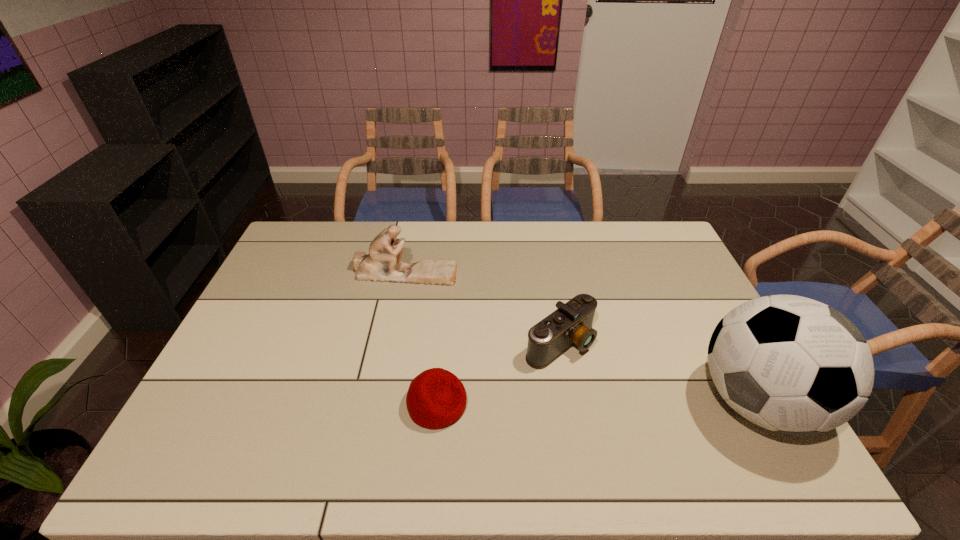
Where is `beanbag`? The height and width of the screenshot is (540, 960). beanbag is located at coordinates (436, 398).

Where is `soccer ball`? Image resolution: width=960 pixels, height=540 pixels. soccer ball is located at coordinates (790, 364).

Image resolution: width=960 pixels, height=540 pixels. What are the coordinates of `the rightmost object` in the screenshot? It's located at (790, 364).

Find the location of `the second tallest object`. the second tallest object is located at coordinates (383, 263).

Where is `the farthest object`? the farthest object is located at coordinates (383, 263).

Find the location of a particular element. This screenshot has height=540, width=960. the second object from right to left is located at coordinates (571, 323).

Identify the location of camera. The image size is (960, 540). (571, 323).

Where is `vacant space located 0.210m on the seat area of the beanbag`? Image resolution: width=960 pixels, height=540 pixels. vacant space located 0.210m on the seat area of the beanbag is located at coordinates (549, 404).

Locate an element on the screen. The width and height of the screenshot is (960, 540). vacant position located on the front-facing side of the figurine is located at coordinates (468, 309).

You are a GUI agent. You are given a task and a screenshot of the screen. Output one action in this format:
    pyautogui.click(x=<x>, y=<y>)
    Task: Click on the free space located 0.360m on the front-facing side of the figurine
    This screenshot has height=540, width=960.
    Given the screenshot: What is the action you would take?
    pyautogui.click(x=513, y=346)